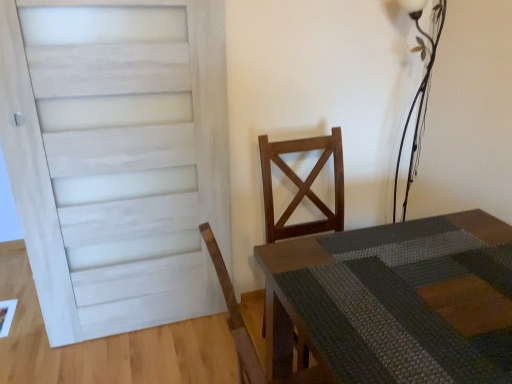
Question: From a real-world perspective, relative to white painted wood door at left, is rustic wood table at center vertically above or below?

Choices:
 (A) below
 (B) above

Answer: (A)

Question: In terms of size, does rustic wood table at center appear bigger or smaller than white painted wood door at left?

Choices:
 (A) big
 (B) small

Answer: (A)

Question: Estimate the real-world distances between objects in this image. Which object is farther from the white painted wood door at left?

Choices:
 (A) rustic wood table at center
 (B) wooden chair at center
 (C) metallic wire at upper right

Answer: (C)

Question: Estimate the real-world distances between objects in this image. Which object is farther from the metallic wire at upper right?

Choices:
 (A) white painted wood door at left
 (B) wooden chair at center
 (C) rustic wood table at center

Answer: (A)